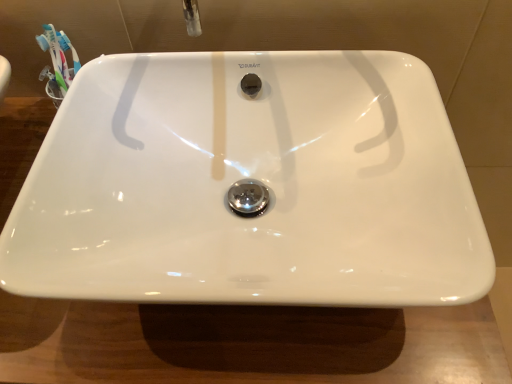
Find the location of a particular element. Image resolution: width=512 pixels, height=384 pixels. white glossy sink at center is located at coordinates (250, 178).

What do you see at coordinates (250, 178) in the screenshot? I see `white glossy sink at center` at bounding box center [250, 178].

Looking at this image, in order to face white glossy sink at center, should I rotate leftwards or rightwards?

You should rotate left by 1.596 degrees.

Locate an element on the screen. This screenshot has width=512, height=384. white glossy sink at center is located at coordinates pyautogui.click(x=250, y=178).